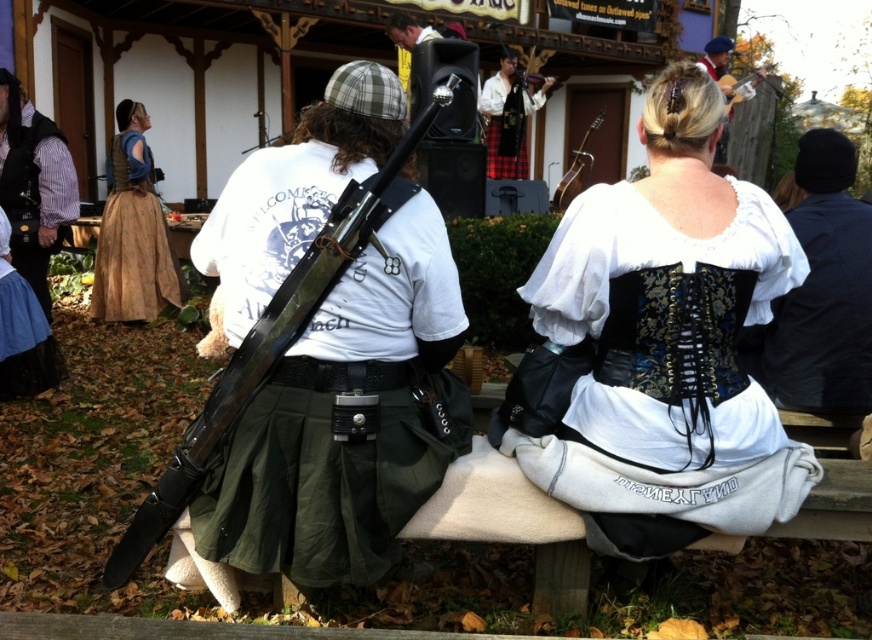
You are a photographer at the event and want to take a photo focusing on the green fabric skirt at center and the metallic silver speaker at center. Which object should you adjust your camera focus to first to ensure both are in focus?

The green fabric skirt at center is closer to the viewer than the metallic silver speaker at center, so you should focus on the green fabric skirt at center first to ensure both are in focus.